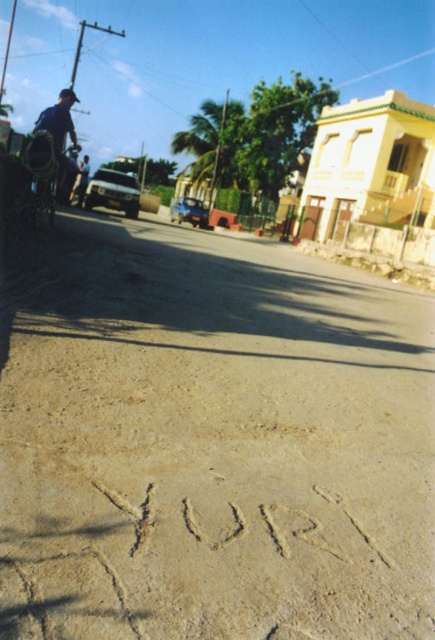
Question: Does brown dirt track at center have a smaller size compared to blue denim shirt at left?

Choices:
 (A) yes
 (B) no

Answer: (A)

Question: Based on their relative distances, which object is farther from the sand/textured sand at center?

Choices:
 (A) brown dirt track at center
 (B) dark blue shirt at left
 (C) blue denim shirt at left

Answer: (B)

Question: Among these objects, which one is nearest to the camera?

Choices:
 (A) brown dirt track at center
 (B) blue denim shirt at left
 (C) dark blue shirt at left

Answer: (A)

Question: Estimate the real-world distances between objects in this image. Which object is farther from the sand/textured sand at center?

Choices:
 (A) dark blue shirt at left
 (B) blue denim shirt at left

Answer: (A)

Question: Is brown dirt track at center to the left of blue denim shirt at left from the viewer's perspective?

Choices:
 (A) yes
 (B) no

Answer: (B)

Question: Can you confirm if brown dirt track at center is positioned to the right of sand/textured sand at center?

Choices:
 (A) yes
 (B) no

Answer: (A)